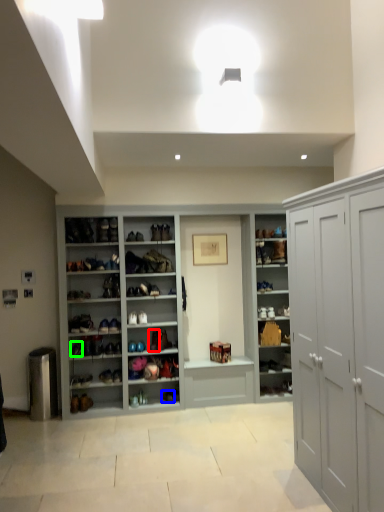
Question: Which is nearer to the shoe (highlighted by a red box)? shoe (highlighted by a blue box) or shoe (highlighted by a green box).

Choices:
 (A) shoe
 (B) shoe

Answer: (A)